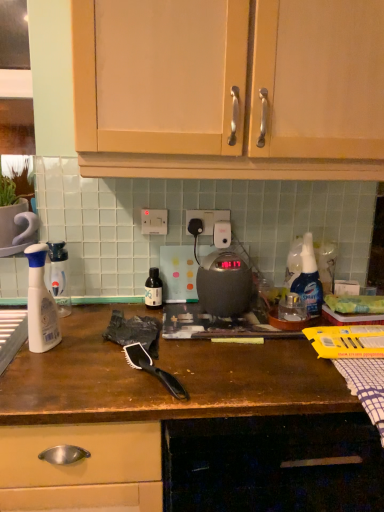
Locate an element on the screen. vacant area that is in front of matte black kettle at center is located at coordinates (233, 346).